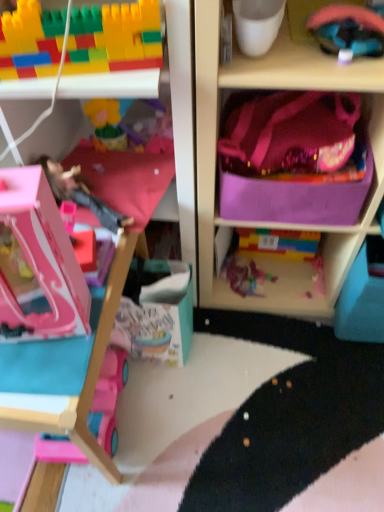
The width and height of the screenshot is (384, 512). I want to click on free location in front of pink plastic toy car at lower left, the fifth toy when ordered from top to bottom, so click(x=71, y=487).